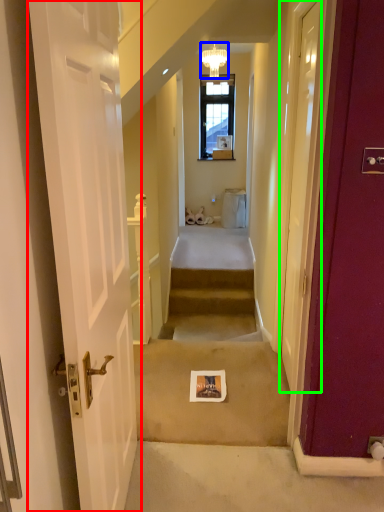
Question: Considering the real-world distances, which object is farthest from door (highlighted by a red box)? light fixture (highlighted by a blue box) or door (highlighted by a green box)?

Choices:
 (A) light fixture
 (B) door

Answer: (A)